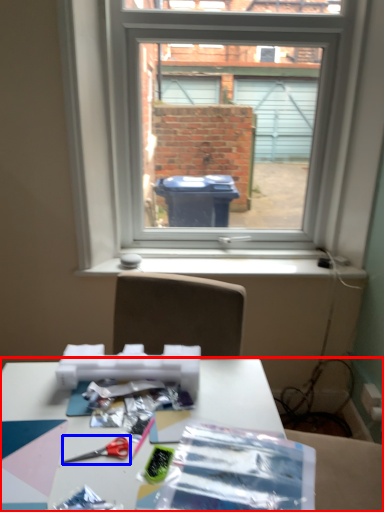
Question: Which object appears farthest to the camera in this image, table (highlighted by a red box) or scissors (highlighted by a blue box)?

Choices:
 (A) table
 (B) scissors

Answer: (B)